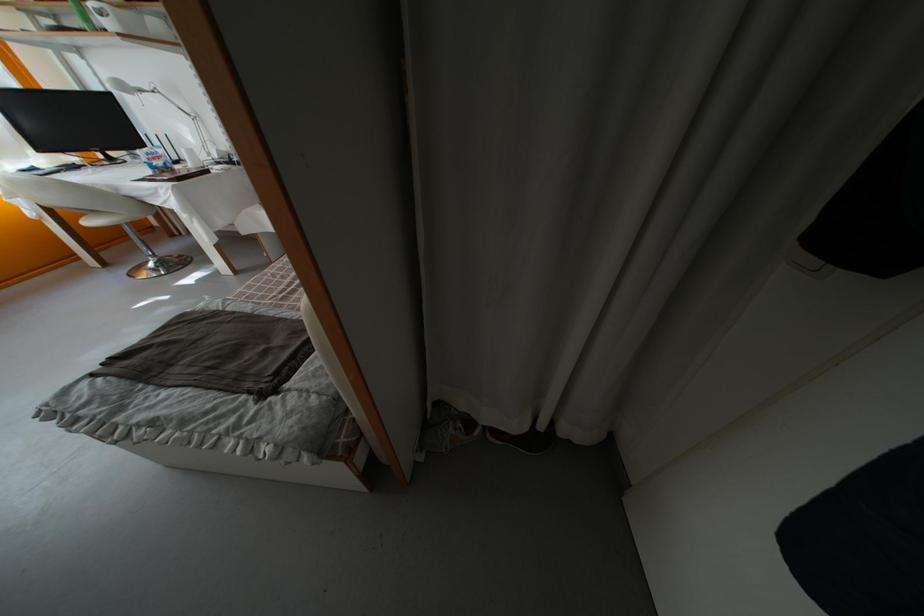
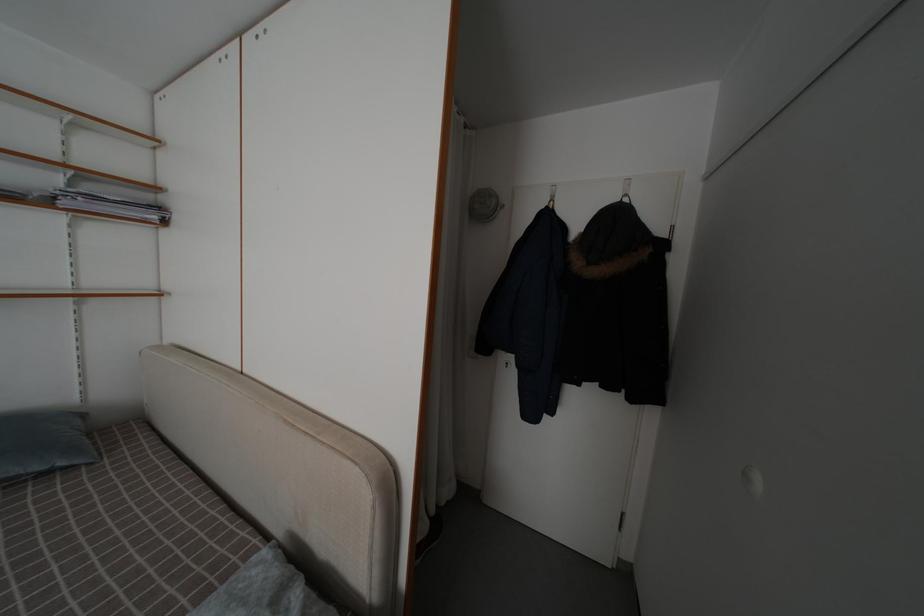
Question: The images are taken continuously from a first-person perspective. In which direction is your viewpoint rotating?

Choices:
 (A) Left
 (B) Right
 (C) Up
 (D) Down

Answer: (B)